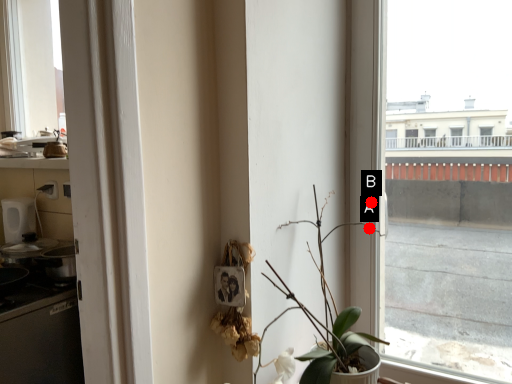
Question: Two points are circled on the image, labeled by A and B beside each circle. Which of the following is the farthest from the observer?

Choices:
 (A) A is further
 (B) B is further

Answer: (A)